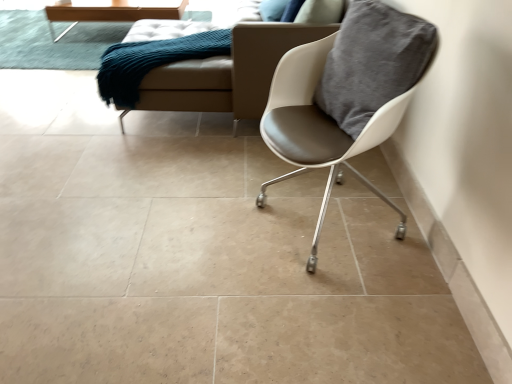
Question: Is wooden table at upper left far away from white leather chair at right?

Choices:
 (A) no
 (B) yes

Answer: (B)

Question: Can you confirm if wooden table at upper left is shorter than white leather chair at right?

Choices:
 (A) no
 (B) yes

Answer: (B)

Question: Considering the relative sizes of wooden table at upper left and white leather chair at right in the image provided, is wooden table at upper left taller than white leather chair at right?

Choices:
 (A) yes
 (B) no

Answer: (B)

Question: Would you say wooden table at upper left is outside white leather chair at right?

Choices:
 (A) yes
 (B) no

Answer: (A)

Question: From the image's perspective, is wooden table at upper left beneath white leather chair at right?

Choices:
 (A) no
 (B) yes

Answer: (A)

Question: Does point (113, 14) appear closer or farther from the camera than point (369, 130)?

Choices:
 (A) farther
 (B) closer

Answer: (A)

Question: Would you say wooden table at upper left is to the left or to the right of white leather chair at right in the picture?

Choices:
 (A) right
 (B) left

Answer: (B)

Question: Looking at their shapes, would you say wooden table at upper left is wider or thinner than white leather chair at right?

Choices:
 (A) thin
 (B) wide

Answer: (B)

Question: Considering their positions, is wooden table at upper left located in front of or behind white leather chair at right?

Choices:
 (A) front
 (B) behind

Answer: (B)

Question: Considering the positions of beige leather couch at upper center and wooden table at upper left in the image, is beige leather couch at upper center taller or shorter than wooden table at upper left?

Choices:
 (A) tall
 (B) short

Answer: (A)

Question: Would you say beige leather couch at upper center is to the left or to the right of wooden table at upper left in the picture?

Choices:
 (A) right
 (B) left

Answer: (A)

Question: Is beige leather couch at upper center in front of or behind wooden table at upper left in the image?

Choices:
 (A) front
 (B) behind

Answer: (A)

Question: Considering the positions of point (313, 26) and point (146, 11), is point (313, 26) closer or farther from the camera than point (146, 11)?

Choices:
 (A) closer
 (B) farther

Answer: (A)

Question: From the image's perspective, is teal fabric couch at upper left positioned above or below wooden table at upper left?

Choices:
 (A) above
 (B) below

Answer: (B)

Question: Is teal fabric couch at upper left inside or outside of wooden table at upper left?

Choices:
 (A) inside
 (B) outside

Answer: (B)